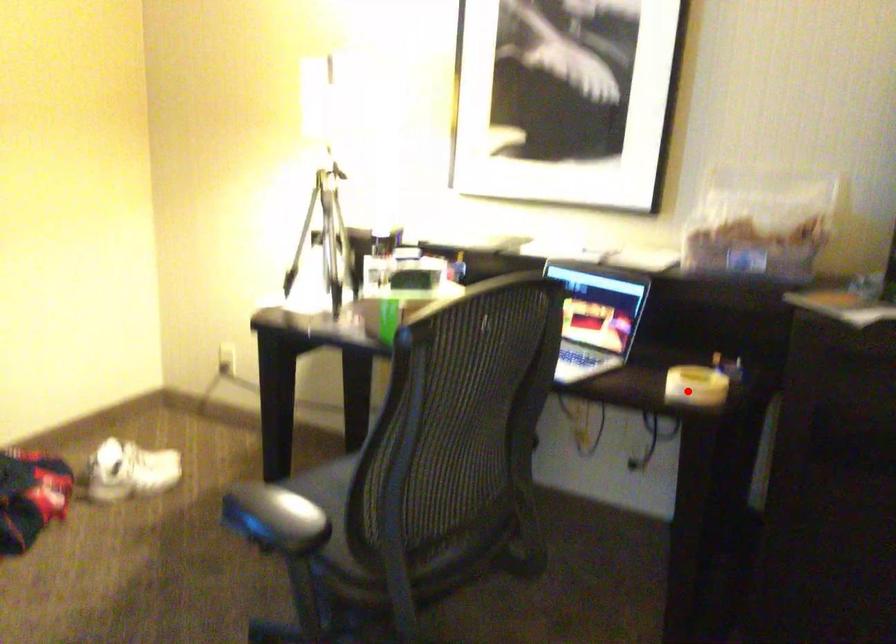
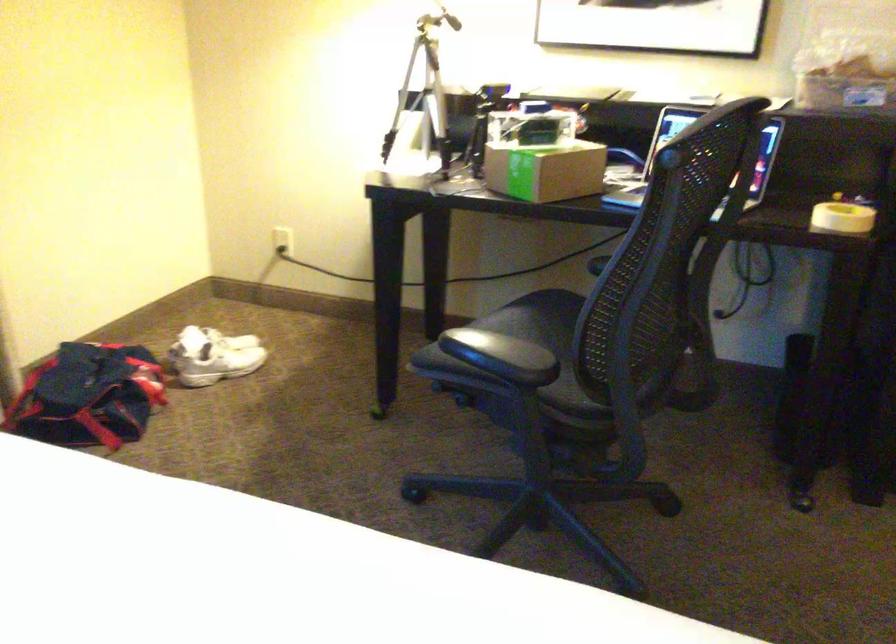
Locate, in the second image, the point that corresponds to the highlighted location in the first image.

(841, 216)